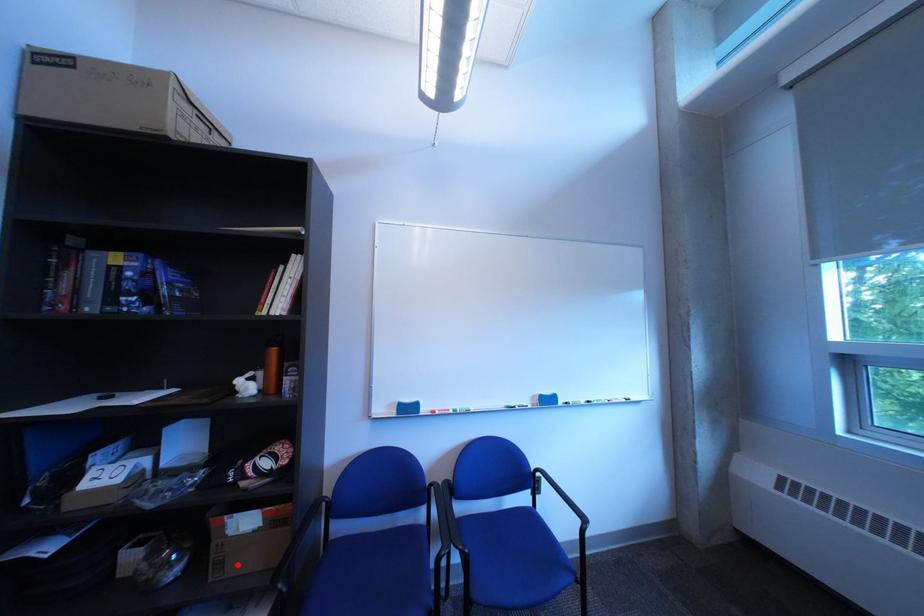
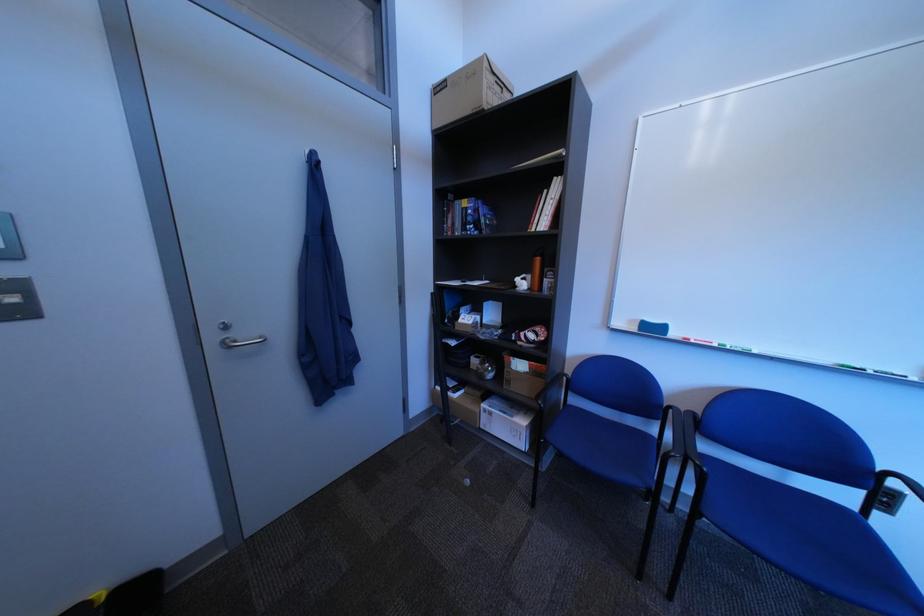
Locate, in the second image, the point that corresponds to the highlighted location in the first image.

(525, 383)